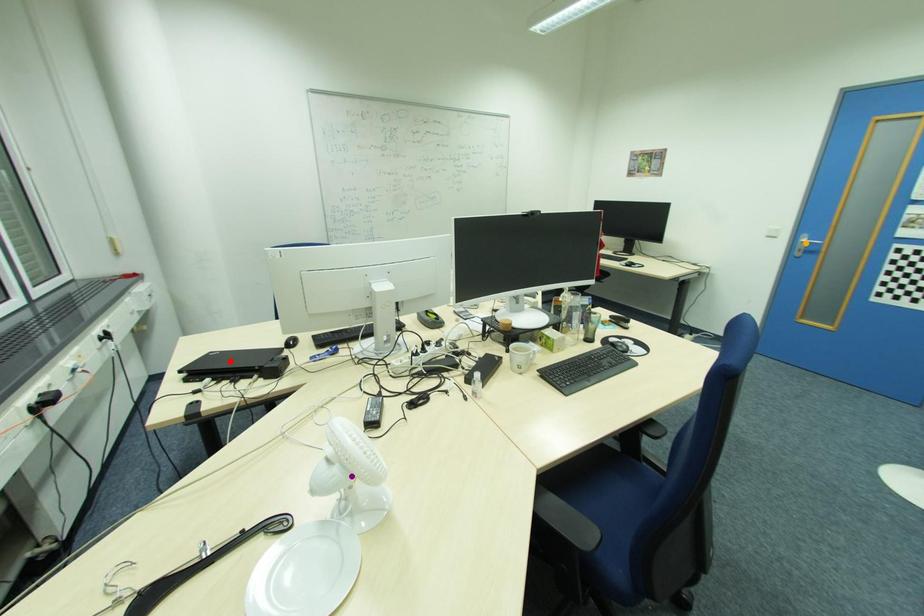
Order these from nearest to farthest:
1. orange point
2. purple point
3. red point

orange point
red point
purple point